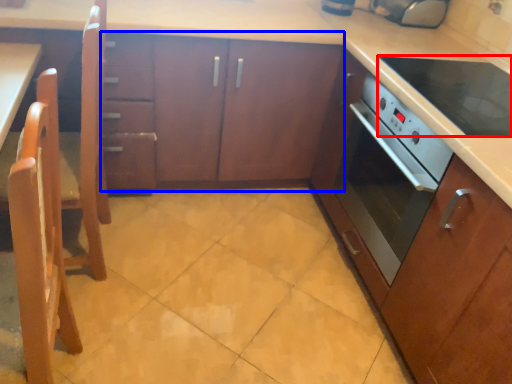
Question: Which point is further to the camera, kitchen appliance (highlighted by a red box) or cabinetry (highlighted by a blue box)?

Choices:
 (A) kitchen appliance
 (B) cabinetry

Answer: (B)